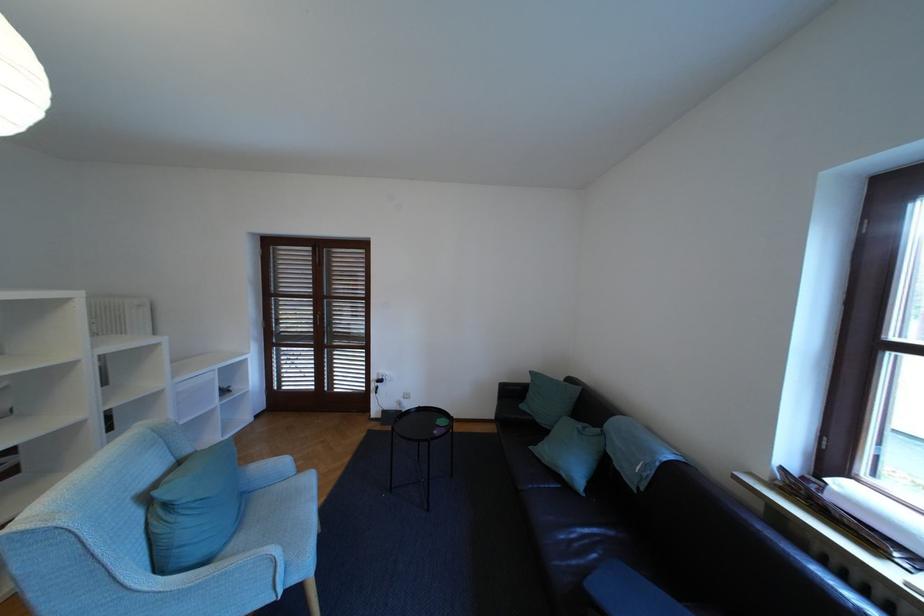
Image resolution: width=924 pixels, height=616 pixels. What do you see at coordinates (322, 318) in the screenshot?
I see `a door shutter handle` at bounding box center [322, 318].